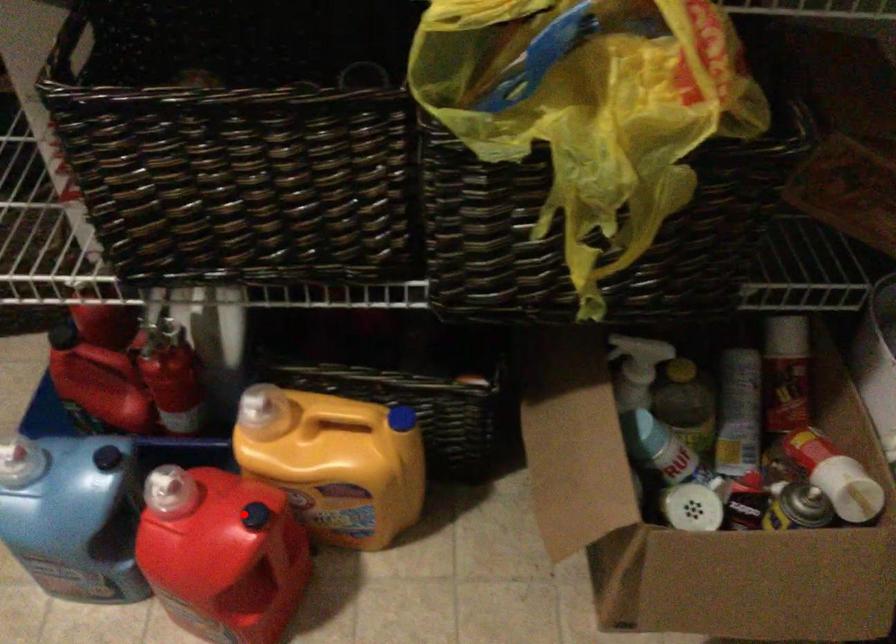
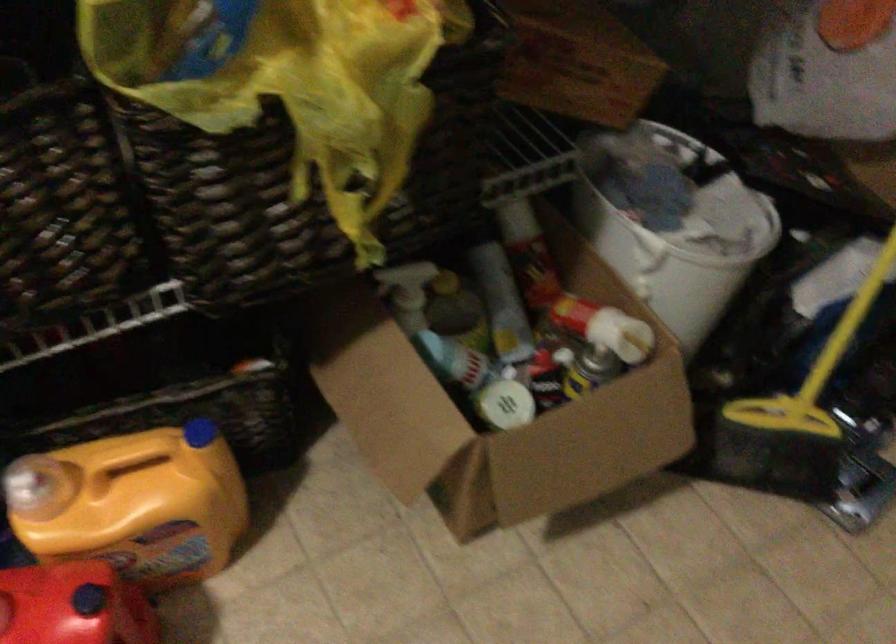
In the second image, find the point that corresponds to the highlighted location in the first image.

(73, 605)